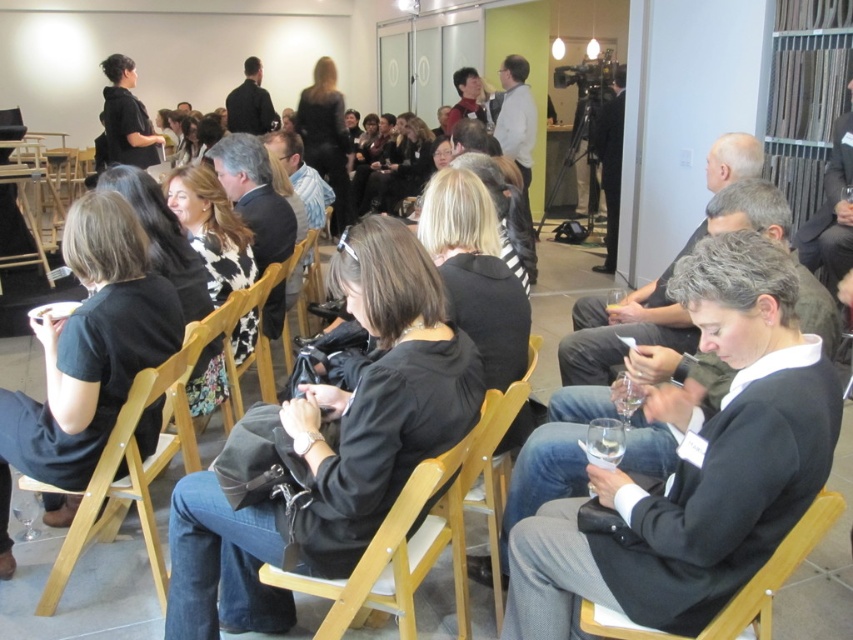
Question: Based on their relative distances, which object is farther from the black matte blazer at center?

Choices:
 (A) black matte jacket at center
 (B) wooden chair at left

Answer: (B)

Question: Which point is closer to the camera?

Choices:
 (A) (158, 374)
 (B) (437, 440)

Answer: (B)

Question: Which of these objects is positioned farthest from the black leather chair at center?

Choices:
 (A) black matte blazer at center
 (B) wooden chair at left

Answer: (B)

Question: Is black matte jacket at center closer to the viewer compared to wooden chair at left?

Choices:
 (A) yes
 (B) no

Answer: (A)

Question: Does black matte blazer at center appear on the right side of wooden chair at left?

Choices:
 (A) yes
 (B) no

Answer: (A)

Question: Is black matte jacket at center smaller than black leather chair at center?

Choices:
 (A) no
 (B) yes

Answer: (A)